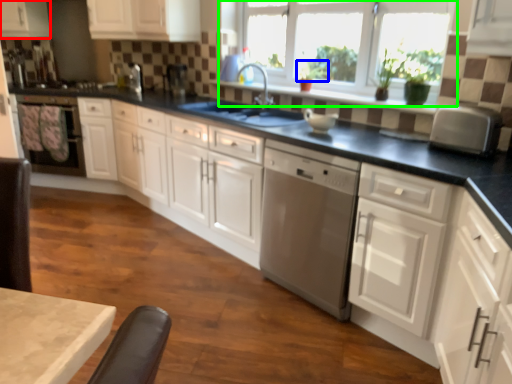
Question: Estimate the real-world distances between objects in this image. Which object is farther from cabinetry (highlighted by a red box), plant (highlighted by a blue box) or window (highlighted by a green box)?

Choices:
 (A) plant
 (B) window

Answer: (A)